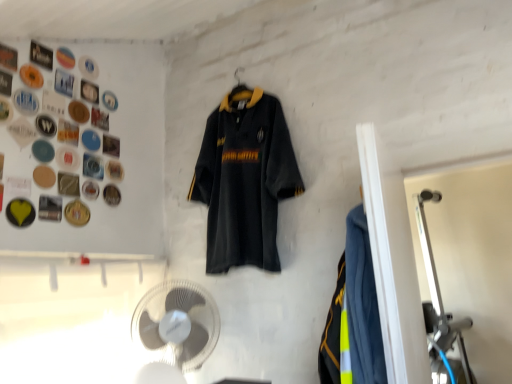
Question: From the image's perspective, is metallic gold button at upper left, which ranks as the third button in bottom-to-top order, located above metallic silver button at upper left, arranged as the third button when viewed from the top?

Choices:
 (A) no
 (B) yes

Answer: (A)

Question: Does metallic gold button at upper left, marked as the 11th button in a top-to-bottom arrangement, have a lesser width compared to metallic silver button at upper left, arranged as the third button when viewed from the top?

Choices:
 (A) no
 (B) yes

Answer: (A)

Question: Does metallic gold button at upper left, marked as the 11th button in a top-to-bottom arrangement, appear on the left side of metallic silver button at upper left, placed as the 11th button when sorted from bottom to top?

Choices:
 (A) no
 (B) yes

Answer: (A)

Question: Is metallic gold button at upper left, marked as the 11th button in a top-to-bottom arrangement, facing away from metallic silver button at upper left, placed as the 11th button when sorted from bottom to top?

Choices:
 (A) no
 (B) yes

Answer: (A)

Question: From a real-world perspective, is metallic gold button at upper left, marked as the 11th button in a top-to-bottom arrangement, positioned over metallic silver button at upper left, arranged as the third button when viewed from the top, based on gravity?

Choices:
 (A) no
 (B) yes

Answer: (A)

Question: Considering their positions, is metallic button at upper left, marked as the twelfth button in a bottom-to-top arrangement, located in front of or behind metallic silver button at upper left, which appears as the 5th button when ordered from the bottom?

Choices:
 (A) front
 (B) behind

Answer: (A)

Question: Which is correct: metallic button at upper left, marked as the twelfth button in a bottom-to-top arrangement, is inside metallic silver button at upper left, which appears as the 5th button when ordered from the bottom, or outside of it?

Choices:
 (A) inside
 (B) outside

Answer: (B)

Question: Considering the positions of point [x=38, y=51] and point [x=109, y=140], is point [x=38, y=51] closer or farther from the camera than point [x=109, y=140]?

Choices:
 (A) farther
 (B) closer

Answer: (B)

Question: Considering the positions of metallic button at upper left, which is the second button in top-to-bottom order, and metallic silver button at upper left, which is counted as the 9th button, starting from the top, in the image, is metallic button at upper left, which is the second button in top-to-bottom order, wider or thinner than metallic silver button at upper left, which is counted as the 9th button, starting from the top,?

Choices:
 (A) wide
 (B) thin

Answer: (A)

Question: Is metallic button at upper left, marked as the twelfth button in a bottom-to-top arrangement, taller or shorter than metallic silver button at upper left, arranged as the 7th button when ordered from the bottom?

Choices:
 (A) short
 (B) tall

Answer: (A)

Question: From the image's perspective, relative to metallic silver button at upper left, arranged as the 7th button when ordered from the bottom, is metallic button at upper left, which is the second button in top-to-bottom order, above or below?

Choices:
 (A) above
 (B) below

Answer: (A)

Question: Is metallic button at upper left, which is the second button in top-to-bottom order, in front of or behind metallic silver button at upper left, arranged as the 7th button when ordered from the bottom, in the image?

Choices:
 (A) behind
 (B) front

Answer: (A)

Question: Is metallic button at upper left, which is the second button in top-to-bottom order, inside the boundaries of metallic silver button at upper left, arranged as the 7th button when ordered from the bottom, or outside?

Choices:
 (A) outside
 (B) inside

Answer: (A)

Question: Is gold metallic button at upper left, the first button positioned from the bottom, in front of or behind matte black button at upper left, the 6th button from the bottom, in the image?

Choices:
 (A) front
 (B) behind

Answer: (B)

Question: From a real-world perspective, is gold metallic button at upper left, the first button positioned from the bottom, above or below matte black button at upper left, the 6th button from the bottom?

Choices:
 (A) below
 (B) above

Answer: (A)